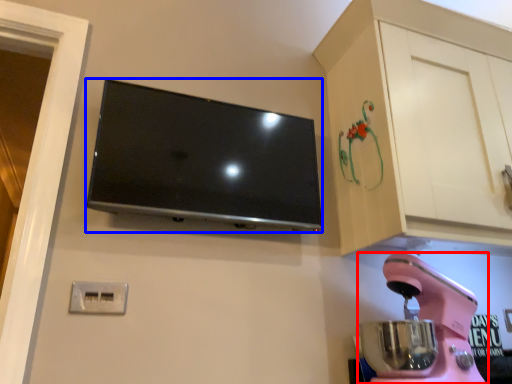
Question: Which object is further to the camera taking this photo, home appliance (highlighted by a red box) or television (highlighted by a blue box)?

Choices:
 (A) home appliance
 (B) television

Answer: (B)